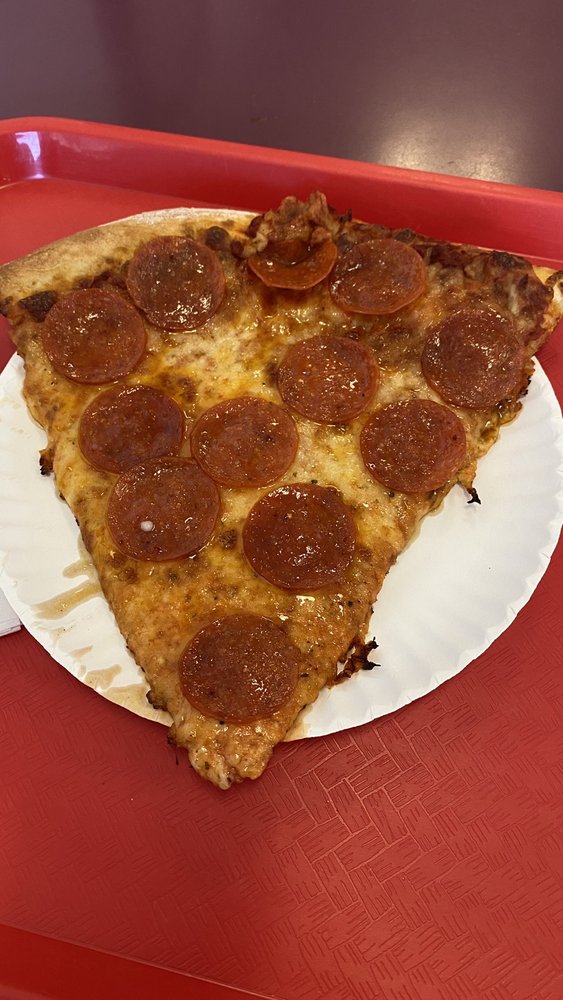
This screenshot has width=563, height=1000. Identify the location of paper plate. (396, 671), (99, 643), (22, 429), (518, 456).